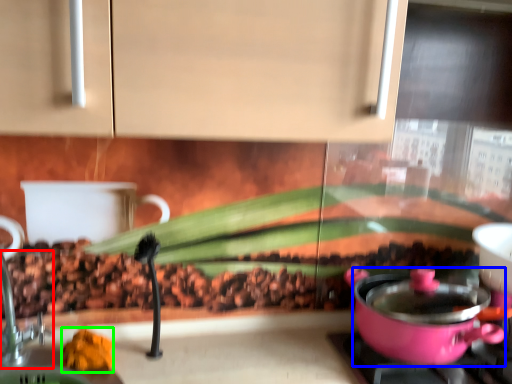
Question: Estimate the real-world distances between objects in this image. Which object is farther from faucet (highlighted by a red box), kitchen appliance (highlighted by a blue box) or food (highlighted by a green box)?

Choices:
 (A) kitchen appliance
 (B) food

Answer: (A)